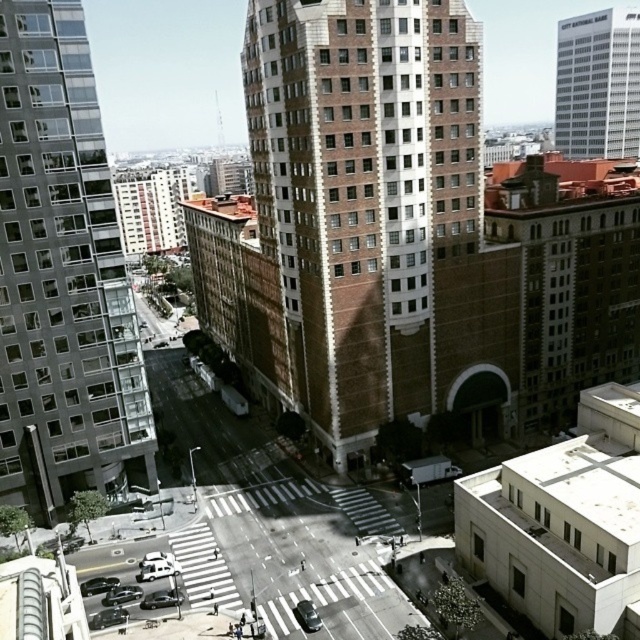
Question: Can you confirm if glassy reflective building at left is thinner than white glass skyscraper at upper right?

Choices:
 (A) no
 (B) yes

Answer: (B)

Question: Which object is positioned closest to the white glass skyscraper at upper right?

Choices:
 (A) glassy reflective building at left
 (B) brown brick building at center

Answer: (B)

Question: Is brown brick building at center bigger than glassy reflective building at left?

Choices:
 (A) yes
 (B) no

Answer: (A)

Question: Can you confirm if brown brick building at center is smaller than glassy reflective building at left?

Choices:
 (A) yes
 (B) no

Answer: (B)

Question: Which of these objects is positioned farthest from the glassy reflective building at left?

Choices:
 (A) white glass skyscraper at upper right
 (B) brown brick building at center

Answer: (A)

Question: Which point is closer to the camera taking this photo?

Choices:
 (A) (612, 144)
 (B) (61, 232)

Answer: (B)